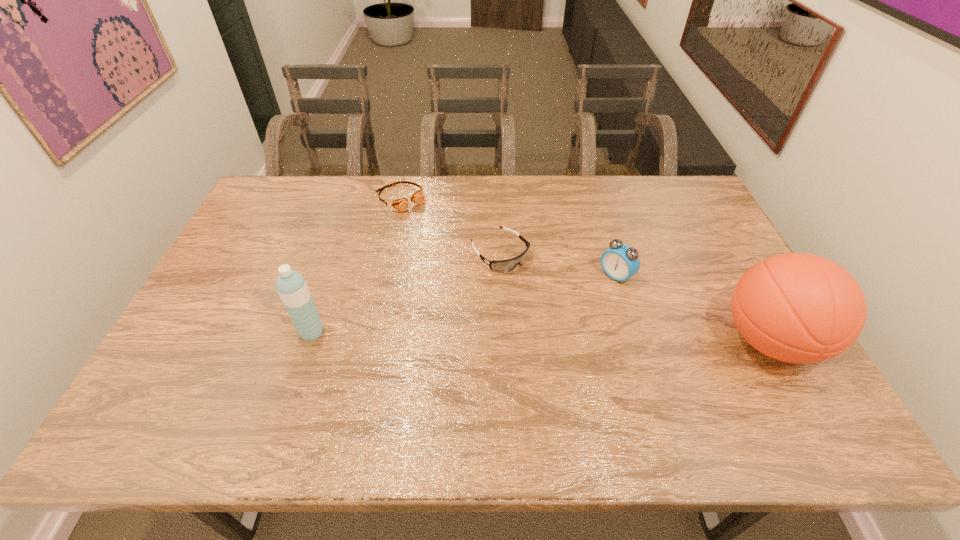
Identify the location of vacant space located on the front and sides of the right goggles. (617, 362).

Where is `vacant region located on the front and sides of the right goggles`? vacant region located on the front and sides of the right goggles is located at coordinates coord(552,302).

The height and width of the screenshot is (540, 960). I want to click on free space located 0.370m on the front and sides of the right goggles, so click(611, 356).

Image resolution: width=960 pixels, height=540 pixels. I want to click on vacant space located on the face of the alarm clock, so [x=587, y=300].

The width and height of the screenshot is (960, 540). Find the location of `free space located on the face of the alarm clock`. free space located on the face of the alarm clock is located at coordinates (556, 326).

Image resolution: width=960 pixels, height=540 pixels. What are the coordinates of `free point located on the face of the alarm clock` in the screenshot? It's located at (595, 293).

Where is `vacant region located 0.330m with the lenses facing forward on the farthest object`? vacant region located 0.330m with the lenses facing forward on the farthest object is located at coordinates (471, 265).

Image resolution: width=960 pixels, height=540 pixels. Find the location of `vacant space located with the lenses facing forward on the farthest object`. vacant space located with the lenses facing forward on the farthest object is located at coordinates (450, 246).

In order to click on vacant space located with the lenses facing forward on the farthest object in this screenshot , I will do `click(444, 239)`.

You are a GUI agent. You are given a task and a screenshot of the screen. Output one action in this format:
    pyautogui.click(x=<x>, y=<y>)
    Task: Click on the object present at the far edge
    This screenshot has width=960, height=540.
    Given the screenshot: What is the action you would take?
    pyautogui.click(x=402, y=204)